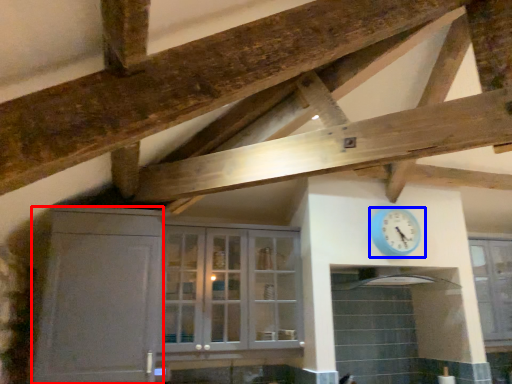
Question: Which point is closer to the camera, cabinetry (highlighted by a red box) or wall clock (highlighted by a blue box)?

Choices:
 (A) cabinetry
 (B) wall clock

Answer: (A)